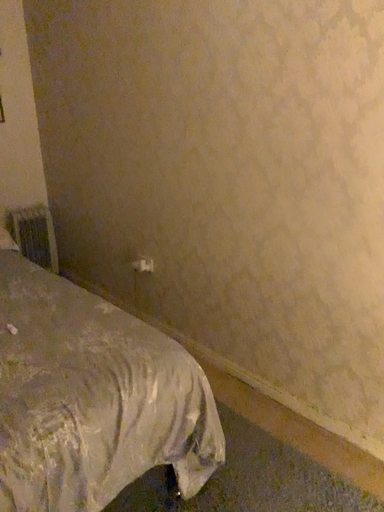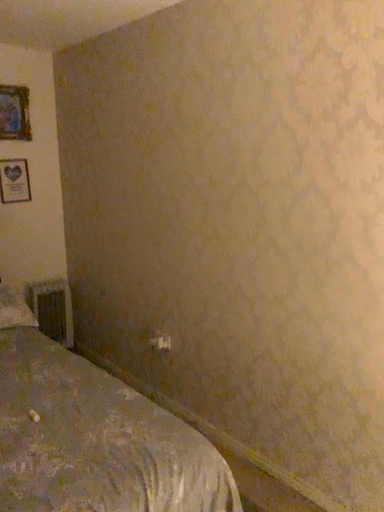
Question: Which way did the camera rotate in the video?

Choices:
 (A) rotated downward
 (B) rotated upward

Answer: (B)